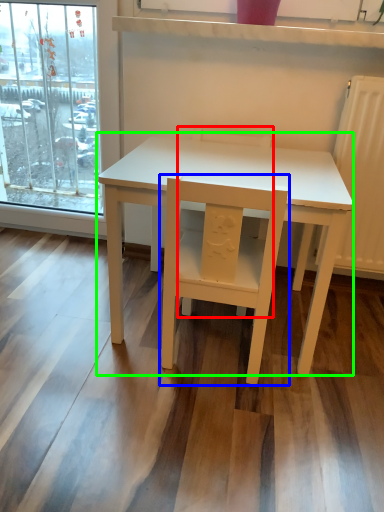
Question: Which object is positioned closest to chair (highlighted by a red box)? Select from chair (highlighted by a blue box) and table (highlighted by a green box).

Choices:
 (A) chair
 (B) table

Answer: (B)